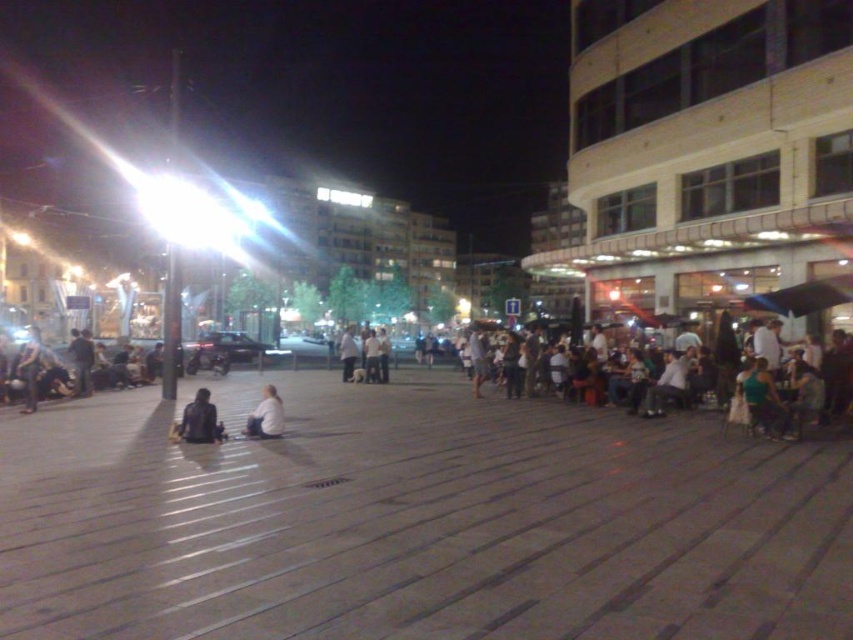
Question: Does dark blue jacket at lower left come in front of white matte shirt at lower center?

Choices:
 (A) no
 (B) yes

Answer: (B)

Question: Does dark blue jacket at lower left appear on the right side of white matte shirt at lower center?

Choices:
 (A) yes
 (B) no

Answer: (B)

Question: Observing the image, what is the correct spatial positioning of dark blue jacket at lower left in reference to white matte shirt at lower center?

Choices:
 (A) right
 (B) left

Answer: (B)